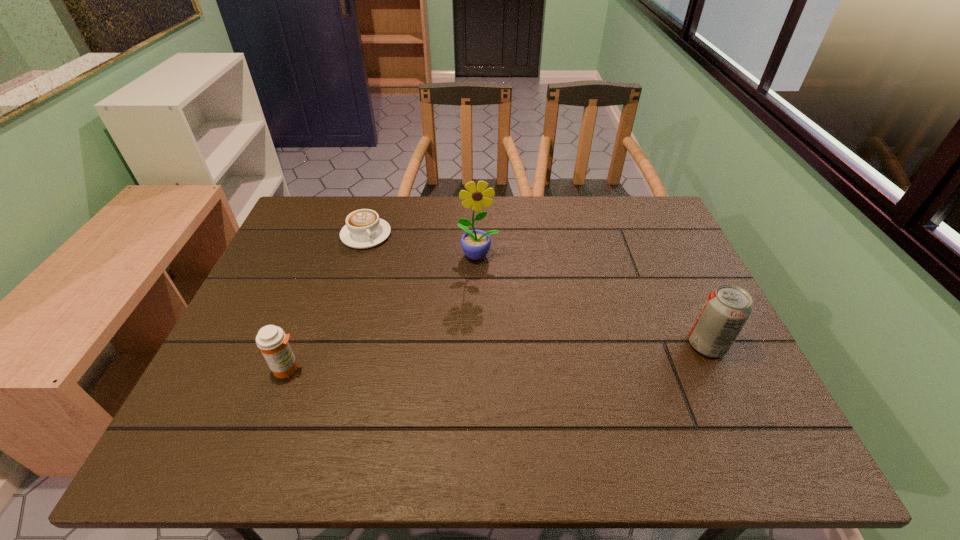
You are a GUI agent. You are given a task and a screenshot of the screen. Output one action in this format:
    pyautogui.click(x=<x>, y=<y>)
    Task: Click on the medicine
    The image size is (960, 540).
    Given the screenshot: What is the action you would take?
    pyautogui.click(x=272, y=341)

Find the location of a particular element. The height and width of the screenshot is (540, 960). the rightmost object is located at coordinates (727, 308).

Where is `the second tallest object`? The height and width of the screenshot is (540, 960). the second tallest object is located at coordinates (727, 308).

At what (x,y) coordinates should I click in order to perform the action: click on the shortest object. Please return your answer as a coordinate pair (x, y). This screenshot has height=540, width=960. Looking at the image, I should click on (364, 229).

I want to click on sunflower, so click(x=475, y=244).

I want to click on the second object from right to left, so [x=475, y=244].

The height and width of the screenshot is (540, 960). Find the location of `vacant space positioned 0.100m on the left of the second shortest object`. vacant space positioned 0.100m on the left of the second shortest object is located at coordinates tap(228, 368).

At what (x,y) coordinates should I click in order to perform the action: click on vacant space located 0.290m on the left of the rightmost object. Please return your answer as a coordinate pair (x, y). The image size is (960, 540). Looking at the image, I should click on (565, 345).

The image size is (960, 540). What are the coordinates of `vacant space situated 0.160m with the handle on the right side of the cappuccino` in the screenshot? It's located at (400, 278).

The image size is (960, 540). Identify the location of vacant point located 0.130m with the handle on the right side of the cappuccino. (396, 272).